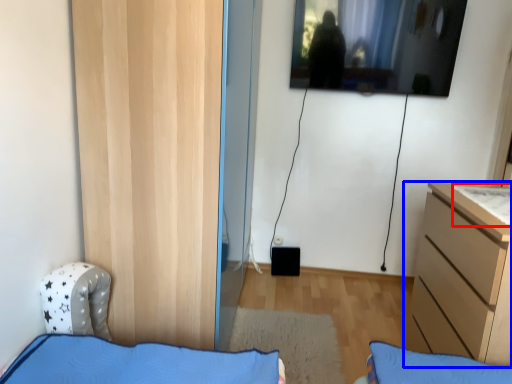
Question: Which of the following is the closest to the observer, sheet (highlighted by a red box) or chest of drawers (highlighted by a blue box)?

Choices:
 (A) sheet
 (B) chest of drawers

Answer: (B)